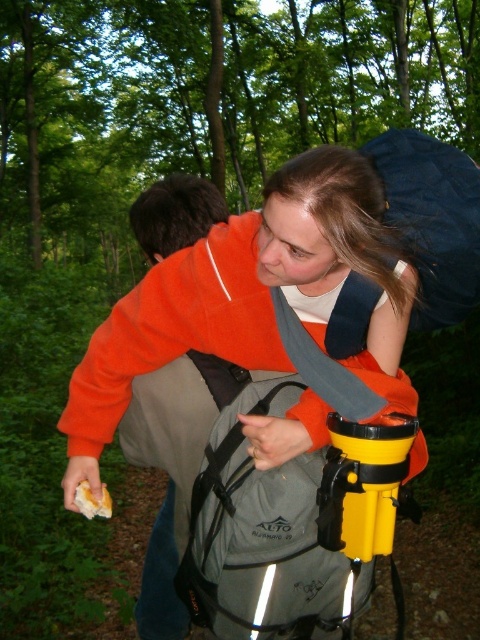
Question: Is orange fleece jacket at center further to the viewer compared to orange fleece jacket at upper left?

Choices:
 (A) no
 (B) yes

Answer: (A)

Question: Is the position of orange fleece jacket at upper left less distant than that of yellow matte bread at lower left?

Choices:
 (A) no
 (B) yes

Answer: (A)

Question: Which point appears farthest from the camera in this image?

Choices:
 (A) click(x=388, y=131)
 (B) click(x=94, y=376)
 (C) click(x=111, y=513)

Answer: (C)

Question: Which point appears closest to the camera in this image?

Choices:
 (A) (406, 163)
 (B) (76, 502)

Answer: (A)

Question: Is orange fleece jacket at center above orange fleece jacket at upper left?

Choices:
 (A) no
 (B) yes

Answer: (B)

Question: Which point is farther to the camera?

Choices:
 (A) (264, 458)
 (B) (215, 404)
 (C) (76, 502)
 (D) (459, 278)

Answer: (C)